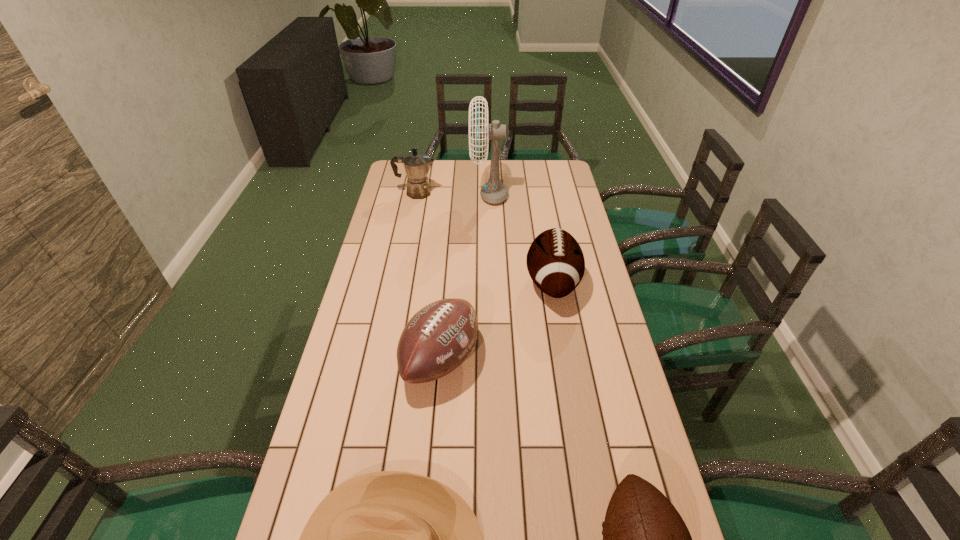
Identify the location of vacant point located between the farthest football and the tallest object. (520, 239).

Where is `vacant area that lies between the leftmost football and the fourth nearest object`? The width and height of the screenshot is (960, 540). vacant area that lies between the leftmost football and the fourth nearest object is located at coordinates (496, 321).

What are the coordinates of `vacant area that lies between the leftmost football and the fan` in the screenshot? It's located at (465, 278).

Locate an element on the screen. This screenshot has width=960, height=540. empty space between the second farthest football and the coffeepot is located at coordinates (x=428, y=276).

I want to click on free space between the fan and the coffeepot, so click(452, 194).

You are a GUI agent. You are given a task and a screenshot of the screen. Output one action in this format:
    pyautogui.click(x=<x>, y=<y>)
    Task: Click on the vacant space that is in between the second nearest football and the farthest football
    This screenshot has width=960, height=540.
    Given the screenshot: What is the action you would take?
    pyautogui.click(x=496, y=321)

Identify the location of vacant area that lies between the leftmost football and the farthest football. The image size is (960, 540). (496, 321).

Select which object is the closest to the cowboy hat. Please provide its 2D coordinates. Your answer should be formatted as a tuple, i.e. [(x, y)], where the tuple contains the x and y coordinates of a point satisfying the conditions above.

[(438, 338)]

Locate an element on the screen. the fourth closest object to the coffeepot is located at coordinates (391, 539).

Identify which football is located as the second nearest to the second farthest football. Please provide its 2D coordinates. Your answer should be formatted as a tuple, i.e. [(x, y)], where the tuple contains the x and y coordinates of a point satisfying the conditions above.

[(645, 539)]